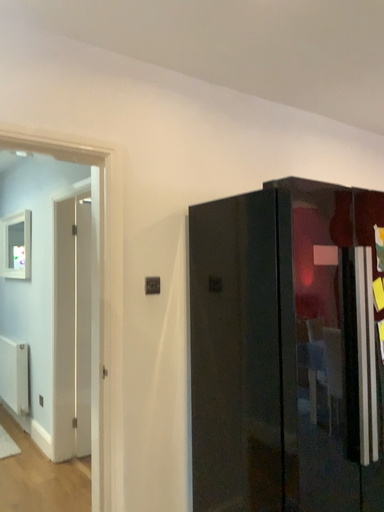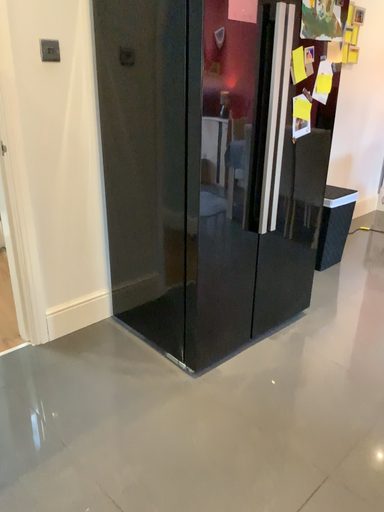
Question: Which way did the camera rotate in the video?

Choices:
 (A) rotated upward
 (B) rotated downward

Answer: (B)